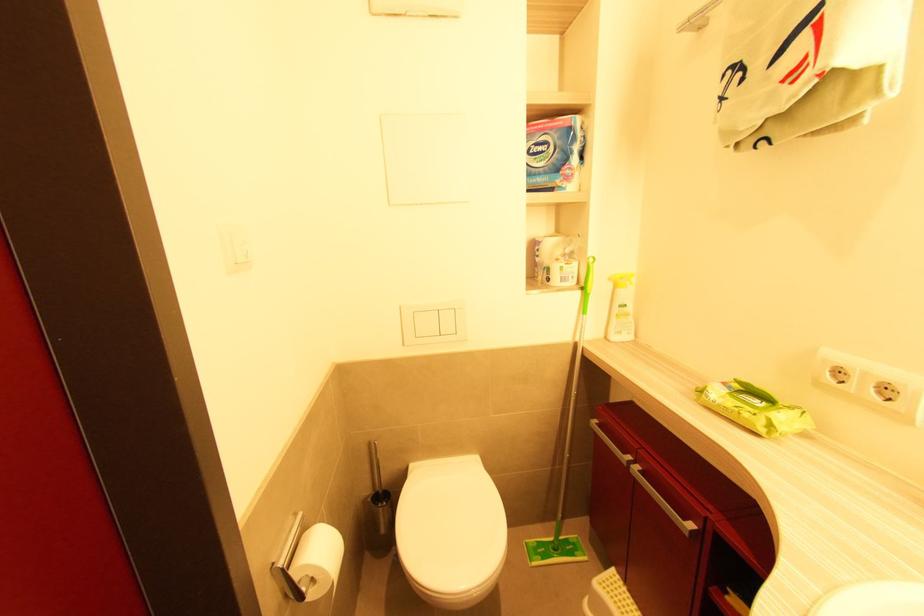
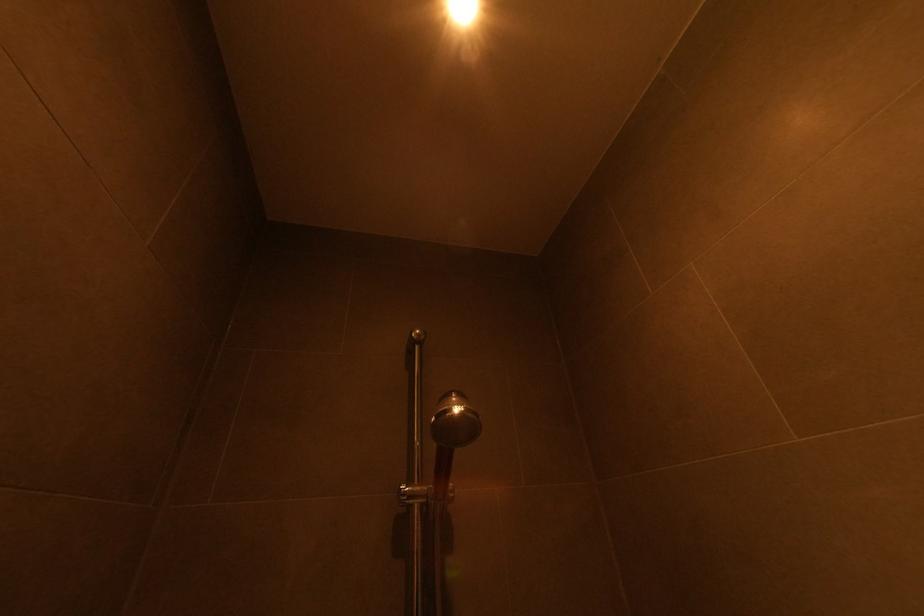
Based on the continuous images, in which direction is the camera rotating?

The camera's rotation is toward right-up.